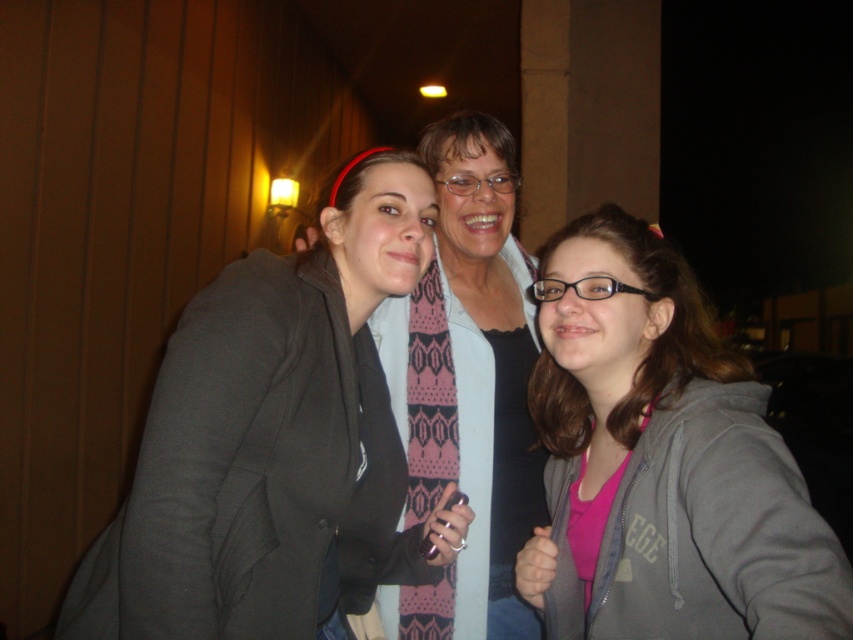
You are taking a photo of two people wearing hoodies. The scene has a matte gray hoodie at center and a pink matte hoodie at center. Which hoodie is positioned to the left?

The matte gray hoodie at center is positioned to the left of the pink matte hoodie at center.

You are trying to decide which hoodie to buy based on the image. Both the matte gray hoodie at center and the pink matte hoodie at center are available. If you want the taller one, which should you choose?

The matte gray hoodie at center is taller than the pink matte hoodie at center, so you should choose the matte gray hoodie at center.

You are trying to decide which hoodie to take for warmth. Both the matte gray hoodie at center and the pink matte hoodie at center are available. Which one might be more suitable based on their sizes?

The matte gray hoodie at center is larger in size than the pink matte hoodie at center, so it might be more suitable for warmth if you prefer a bigger size.